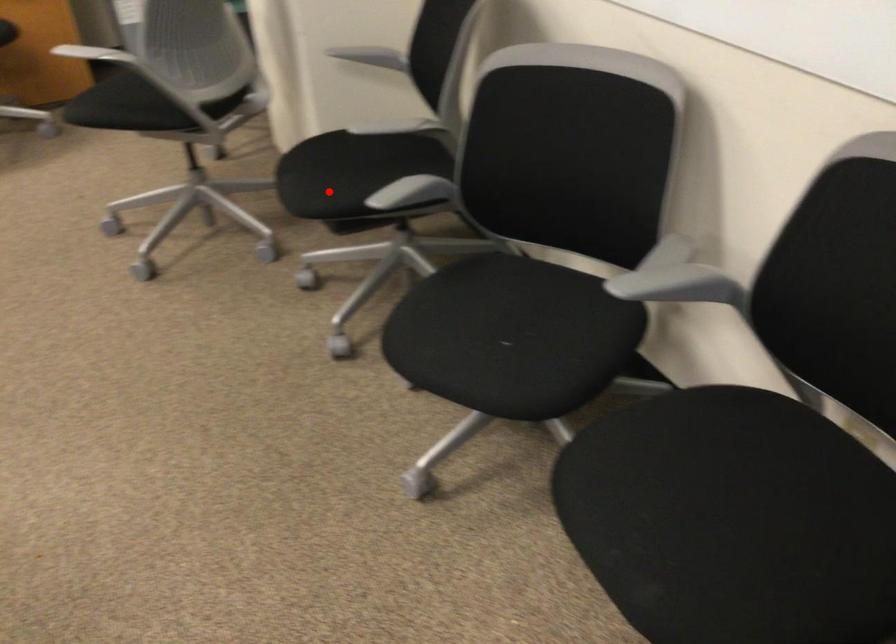
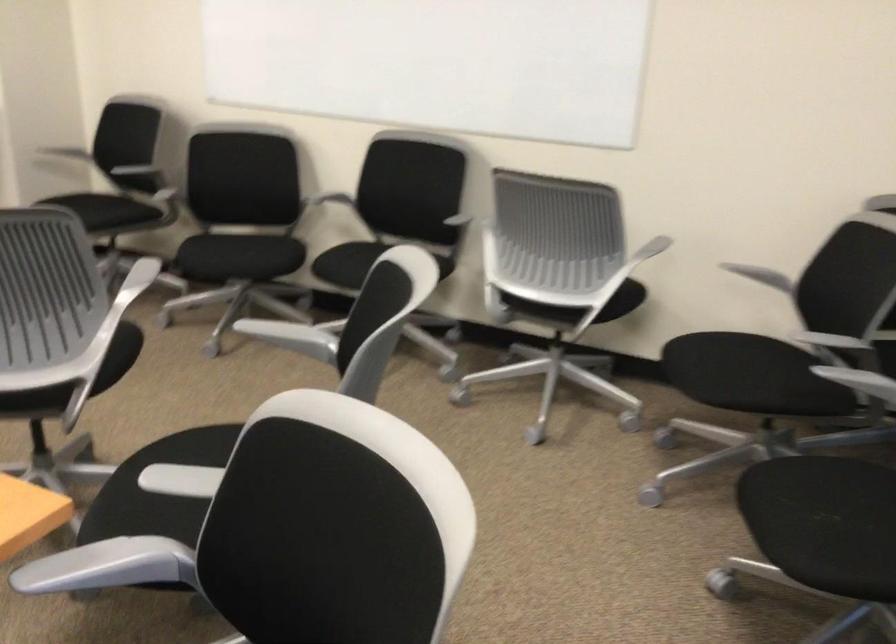
Question: I am providing you with two images of the same scene from different viewpoints. Image1 has a red point marked. In image2, the corresponding 3D location appears at what relative position? Reply with the corresponding letter.

Choices:
 (A) Closer
 (B) Farther

Answer: (B)